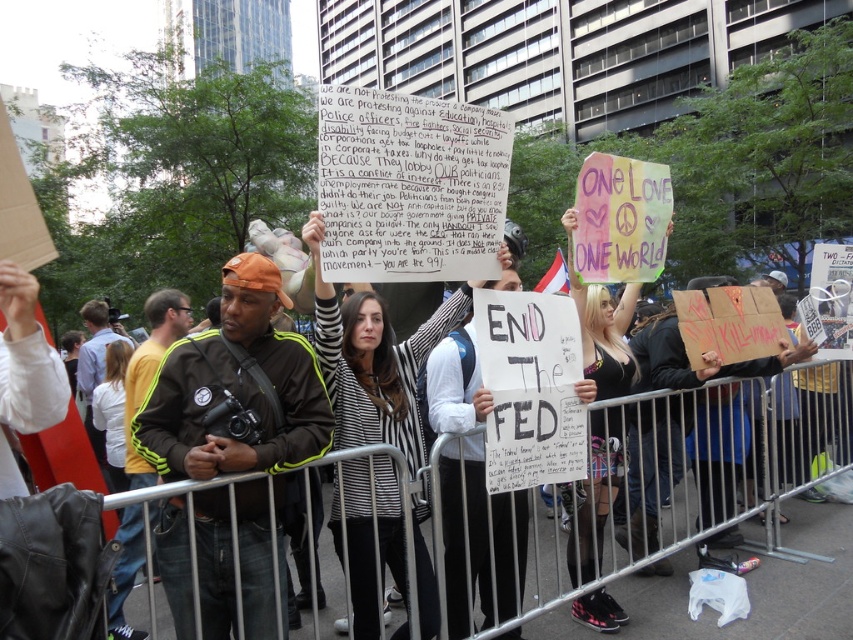
Question: Among these points, which one is farthest from the camera?

Choices:
 (A) (102, 504)
 (B) (234, 365)

Answer: (B)

Question: Can you confirm if green adidas jacket at center is smaller than striped sweater at center?

Choices:
 (A) yes
 (B) no

Answer: (A)

Question: Based on their relative distances, which object is nearer to the striped sweater at center?

Choices:
 (A) matte black jacket at center
 (B) green adidas jacket at center

Answer: (A)

Question: Which of the following is the farthest from the observer?

Choices:
 (A) (419, 458)
 (B) (244, 550)

Answer: (A)

Question: Is matte black jacket at center to the left of green adidas jacket at center from the viewer's perspective?

Choices:
 (A) no
 (B) yes

Answer: (A)

Question: Is matte black jacket at center further to the viewer compared to striped sweater at center?

Choices:
 (A) no
 (B) yes

Answer: (A)